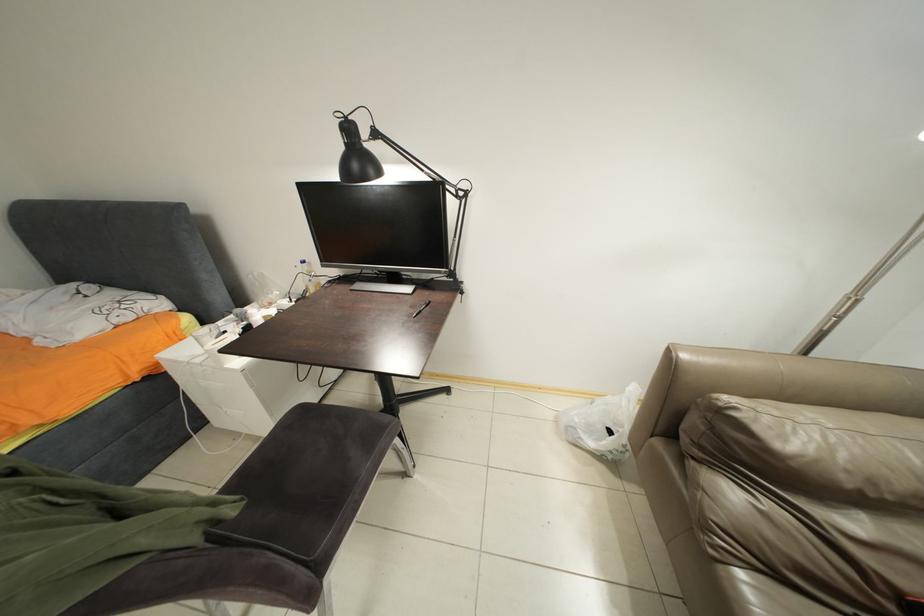
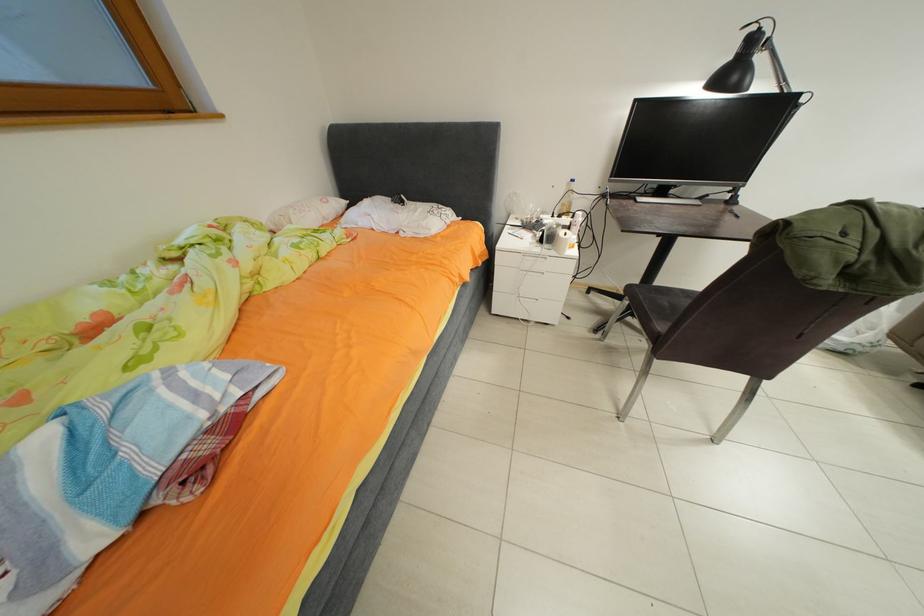
Question: In a continuous first-person perspective shot, in which direction is the camera moving?

Choices:
 (A) Left
 (B) Right
 (C) Forward
 (D) Backward

Answer: (A)